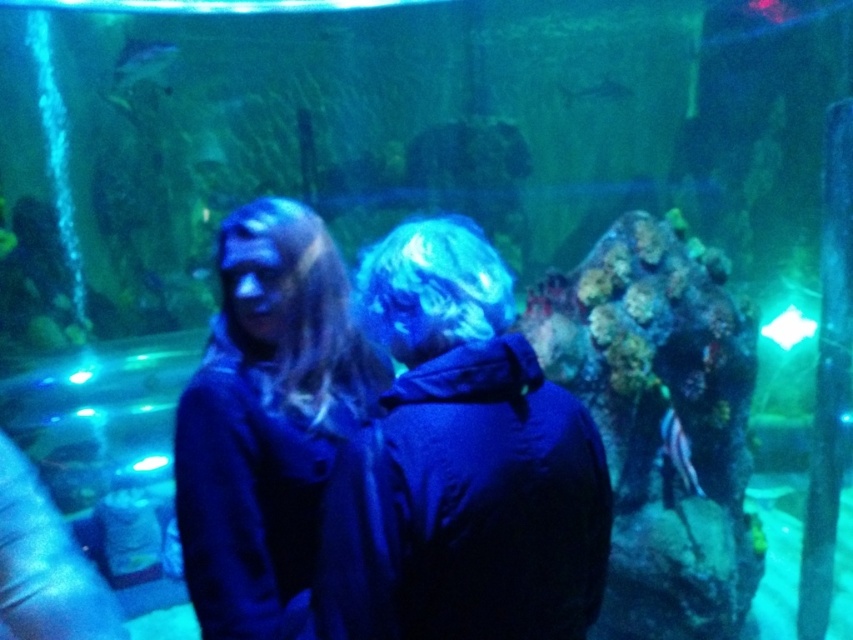
Who is more forward, (253, 586) or (666, 433)?

Positioned in front is point (253, 586).

Between matte blue scarf at center and striped fabric fish at center, which one is positioned lower?

striped fabric fish at center

Based on the photo, who is more distant from viewer, (x=234, y=316) or (x=683, y=454)?

The point (x=683, y=454) is more distant.

At what (x,y) coordinates should I click in order to perform the action: click on matte blue scarf at center. Please return your answer as a coordinate pair (x, y). Looking at the image, I should click on (x=267, y=417).

Which of these two, matte blue scarf at center or shiny silver fish at upper left, stands shorter?

With less height is shiny silver fish at upper left.

The height and width of the screenshot is (640, 853). What are the coordinates of `matte blue scarf at center` in the screenshot? It's located at (267, 417).

Does point (418, 604) lie in front of point (672, 449)?

Yes.

Can you confirm if dark blue fabric at center is wider than striped fabric fish at center?

Yes.

This screenshot has width=853, height=640. What do you see at coordinates (461, 465) in the screenshot? I see `dark blue fabric at center` at bounding box center [461, 465].

At what (x,y) coordinates should I click in order to perform the action: click on dark blue fabric at center. Please return your answer as a coordinate pair (x, y). The height and width of the screenshot is (640, 853). Looking at the image, I should click on (461, 465).